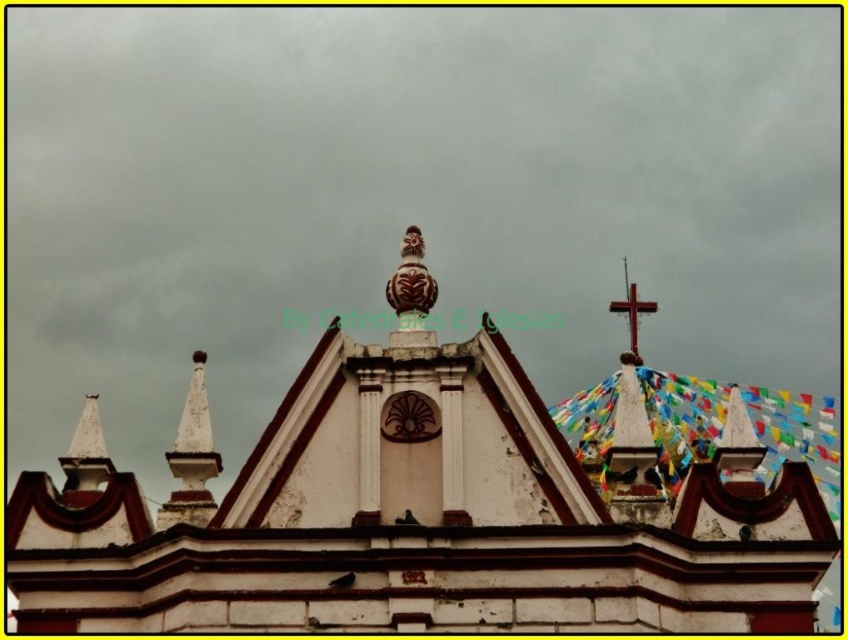
You are standing in front of a church and want to take a photo of the white painted stone church at center. If the camera can only focus on objects within a 0.5 unit radius centered at point 0.5, 0.5, will the church be in focus?

The white painted stone church at center is located at point [408,513]. The distance between this point and the focus center at [424,320] is sqrt of squared differences. Calculating sqrt of squared differences between 0.802 and 0.5 in x and 0.482 and 0.5 in y. The squared differences are 0.302 squared and 0.018 squared. Adding them gives 0.091204 plus 0.000324 equals 0.091528. Square root of that is approximately 0.3025 units. Since 0.3025 is less than 0.5, the church will be in focus.

You are standing in a park and see the white painted stone church at center in the distance. If you want to take a photo of it, would you need to zoom in your camera lens to capture the entire church structure?

The white painted stone church at center is 81.73 meters away from the camera. To capture the entire structure in a single photo, you would likely need to use a wide angle lens instead of zooming in, as zooming would narrow the field of view and might exclude parts of the church due to its distance.

You are standing in front of the church and want to take a photo that includes both the white painted stone church at center and the wooden cross at upper right. Which direction should you move to ensure both are visible in your frame?

You should move to the left of the white painted stone church at center so that the wooden cross at upper right is positioned to the right of the church in your frame, ensuring both are visible.